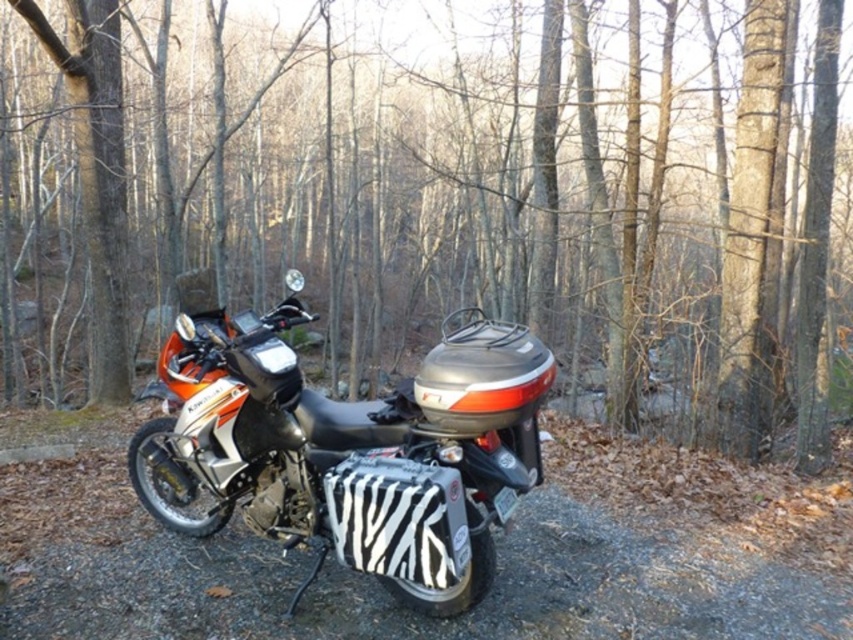
Question: Which point is farther to the camera?

Choices:
 (A) (209, 136)
 (B) (383, 564)

Answer: (A)

Question: Is brown bark tree at center in front of zebra-patterned bag at center?

Choices:
 (A) yes
 (B) no

Answer: (B)

Question: Among these objects, which one is nearest to the camera?

Choices:
 (A) brown bark tree at center
 (B) zebra-patterned bag at center

Answer: (B)

Question: Is brown bark tree at center positioned in front of zebra-patterned bag at center?

Choices:
 (A) yes
 (B) no

Answer: (B)

Question: Which object appears closest to the camera in this image?

Choices:
 (A) brown bark tree at center
 (B) zebra-patterned bag at center

Answer: (B)

Question: Where is brown bark tree at center located in relation to zebra-patterned bag at center in the image?

Choices:
 (A) left
 (B) right

Answer: (A)